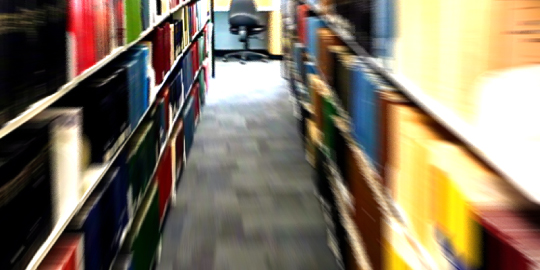
Identify the location of green books. The width and height of the screenshot is (540, 270). (143, 149), (150, 224), (132, 21).